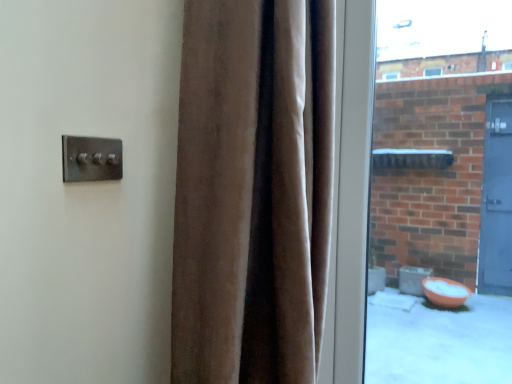
The height and width of the screenshot is (384, 512). What do you see at coordinates (252, 190) in the screenshot? I see `velvet brown curtain at center` at bounding box center [252, 190].

Describe the element at coordinates (422, 192) in the screenshot. I see `clear glass window at right` at that location.

The height and width of the screenshot is (384, 512). I want to click on velvet brown curtain at center, so click(x=252, y=190).

Is satin silver switch at upper left looking in the opposite direction of velvet brown curtain at center?

That's not correct — satin silver switch at upper left is not looking away from velvet brown curtain at center.

From a real-world perspective, which is physically below, satin silver switch at upper left or velvet brown curtain at center?

velvet brown curtain at center.

Is satin silver switch at upper left next to velvet brown curtain at center?

satin silver switch at upper left and velvet brown curtain at center are clearly separated.

From the image's perspective, is velvet brown curtain at center located above or below clear glass window at right?

Clearly, from the image's perspective, velvet brown curtain at center is below clear glass window at right.

Is velvet brown curtain at center positioned with its back to clear glass window at right?

velvet brown curtain at center is not turned away from clear glass window at right.

Who is smaller, velvet brown curtain at center or clear glass window at right?

Smaller between the two is clear glass window at right.

The height and width of the screenshot is (384, 512). Find the location of `curtain to the left of clear glass window at right`. curtain to the left of clear glass window at right is located at coordinates (252, 190).

Is clear glass window at right placed right next to satin silver switch at upper left?

clear glass window at right is not next to satin silver switch at upper left, and they're not touching.

Is the position of clear glass window at right more distant than that of satin silver switch at upper left?

Yes, clear glass window at right is further from the viewer.

Is clear glass window at right taller than satin silver switch at upper left?

Correct, clear glass window at right is much taller as satin silver switch at upper left.

In the image, is clear glass window at right on the left side or the right side of satin silver switch at upper left?

In the image, clear glass window at right appears on the right side of satin silver switch at upper left.

Is satin silver switch at upper left at the left side of clear glass window at right?

Yes, satin silver switch at upper left is to the left of clear glass window at right.

From the image's perspective, is satin silver switch at upper left under clear glass window at right?

No.

Considering the sizes of objects satin silver switch at upper left and clear glass window at right in the image provided, who is taller, satin silver switch at upper left or clear glass window at right?

clear glass window at right.

Can you confirm if clear glass window at right is positioned to the right of velvet brown curtain at center?

Correct, you'll find clear glass window at right to the right of velvet brown curtain at center.

From a real-world perspective, is clear glass window at right over velvet brown curtain at center?

Yes.

Does clear glass window at right have a smaller size compared to velvet brown curtain at center?

Correct, clear glass window at right occupies less space than velvet brown curtain at center.

Is clear glass window at right not within velvet brown curtain at center?

Yes, clear glass window at right is outside of velvet brown curtain at center.

Is velvet brown curtain at center next to satin silver switch at upper left?

velvet brown curtain at center and satin silver switch at upper left are clearly separated.

Between point (222, 201) and point (95, 163), which one is positioned behind?

The point (95, 163) is farther.

Does velvet brown curtain at center come behind satin silver switch at upper left?

No, the depth of velvet brown curtain at center is less than that of satin silver switch at upper left.

From a real-world perspective, is velvet brown curtain at center physically below satin silver switch at upper left?

Correct, in the physical world, velvet brown curtain at center is lower than satin silver switch at upper left.

Where is `door handle that is behind the velvet brown curtain at center`? door handle that is behind the velvet brown curtain at center is located at coordinates (91, 159).

I want to click on curtain in front of the clear glass window at right, so click(x=252, y=190).

Which object lies further to the anchor point clear glass window at right, satin silver switch at upper left or velvet brown curtain at center?

Among the two, satin silver switch at upper left is located further to clear glass window at right.

Considering their positions, is velvet brown curtain at center positioned further to satin silver switch at upper left than clear glass window at right?

clear glass window at right is further to satin silver switch at upper left.

From the image, which object appears to be nearer to velvet brown curtain at center, clear glass window at right or satin silver switch at upper left?

satin silver switch at upper left lies closer to velvet brown curtain at center than the other object.

Looking at the image, which one is located closer to velvet brown curtain at center, satin silver switch at upper left or clear glass window at right?

satin silver switch at upper left.

Based on their spatial positions, is velvet brown curtain at center or satin silver switch at upper left closer to clear glass window at right?

velvet brown curtain at center is closer to clear glass window at right.

Consider the image. Estimate the real-world distances between objects in this image. Which object is closer to satin silver switch at upper left, clear glass window at right or velvet brown curtain at center?

The object closer to satin silver switch at upper left is velvet brown curtain at center.

Locate an element on the screen. curtain between satin silver switch at upper left and clear glass window at right in the horizontal direction is located at coordinates (252, 190).